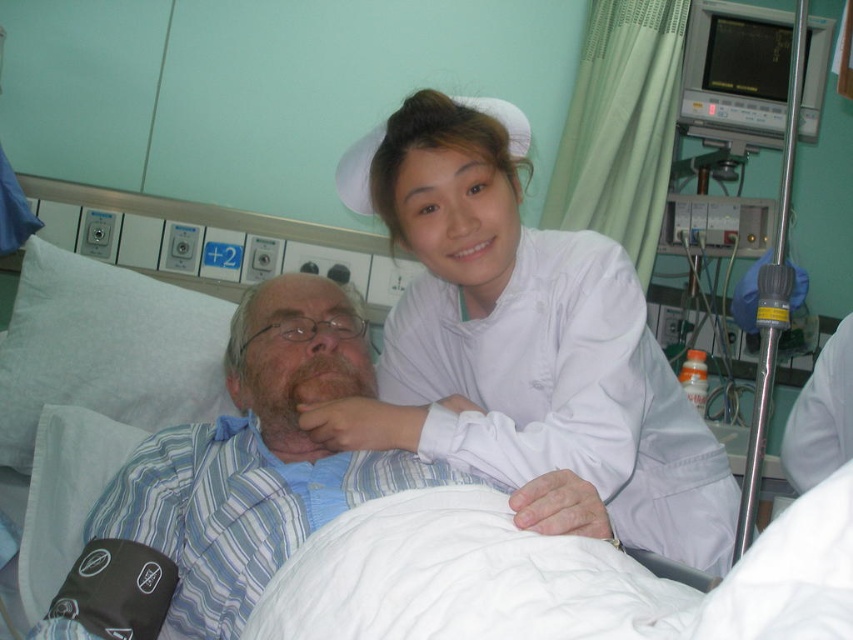
Is point (213, 476) less distant than point (811, 385)?

Yes, point (213, 476) is in front of point (811, 385).

Which is in front, point (276, 570) or point (830, 428)?

Point (276, 570)

Between point (231, 518) and point (805, 401), which one is positioned behind?

The point (805, 401) is more distant.

Identify the location of white cotton shirt at center. (257, 460).

Who is positioned more to the right, white smooth nurse cap at upper center or white fabric bed at center?

Positioned to the right is white fabric bed at center.

Which is behind, point (416, 442) or point (454, 512)?

Point (416, 442)

This screenshot has width=853, height=640. Find the location of `white smooth nurse cap at upper center`. white smooth nurse cap at upper center is located at coordinates (526, 346).

Is white fabric bed at center shorter than white smooth uniform at upper center?

Correct, white fabric bed at center is not as tall as white smooth uniform at upper center.

Image resolution: width=853 pixels, height=640 pixels. What do you see at coordinates (550, 579) in the screenshot?
I see `white fabric bed at center` at bounding box center [550, 579].

Where is `white fabric bed at center`? The width and height of the screenshot is (853, 640). white fabric bed at center is located at coordinates click(550, 579).